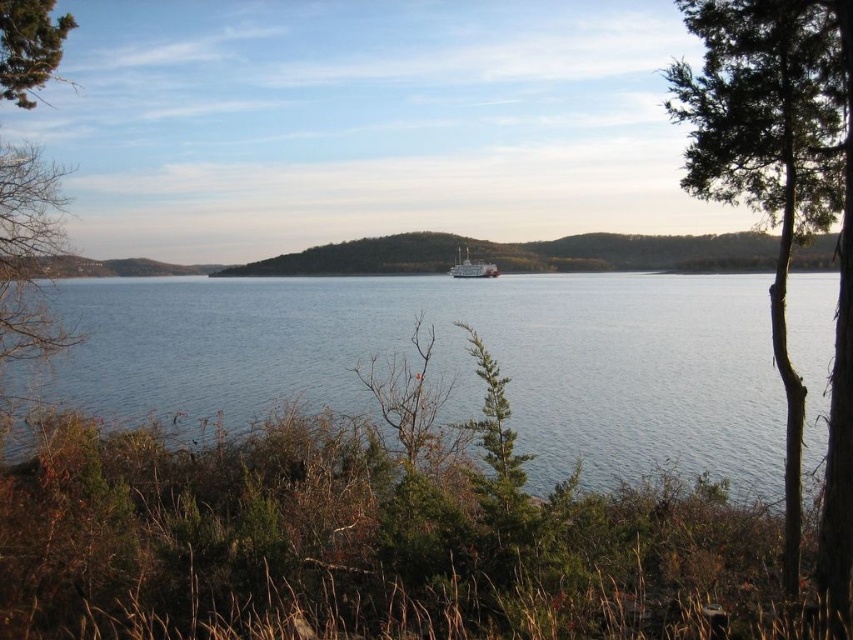
Question: Is green leafy tree at right to the left of white matte boat at center from the viewer's perspective?

Choices:
 (A) no
 (B) yes

Answer: (A)

Question: Which object is closer to the camera taking this photo?

Choices:
 (A) green leafy tree at upper left
 (B) white matte boat at center
 (C) blue water at center
 (D) green leafy tree at right

Answer: (C)

Question: Is green leafy tree at right below green leafy tree at upper left?

Choices:
 (A) yes
 (B) no

Answer: (A)

Question: Does green leafy tree at upper left have a smaller size compared to white matte boat at center?

Choices:
 (A) no
 (B) yes

Answer: (A)

Question: Which point is closer to the camera taking this photo?

Choices:
 (A) coord(479,316)
 (B) coord(28,77)

Answer: (B)

Question: Estimate the real-world distances between objects in this image. Which object is closer to the green leafy tree at right?

Choices:
 (A) white matte boat at center
 (B) blue water at center
 (C) green leafy tree at upper left

Answer: (B)